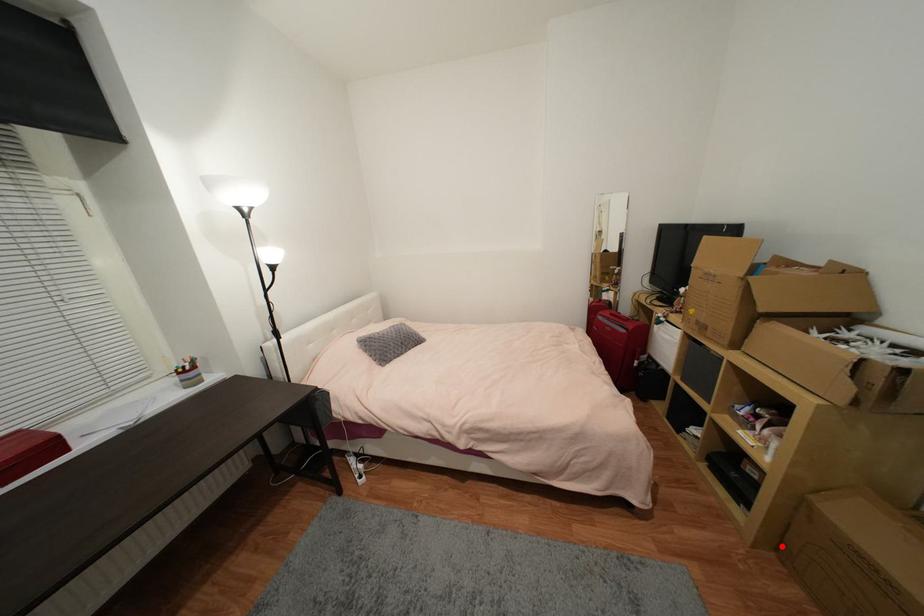
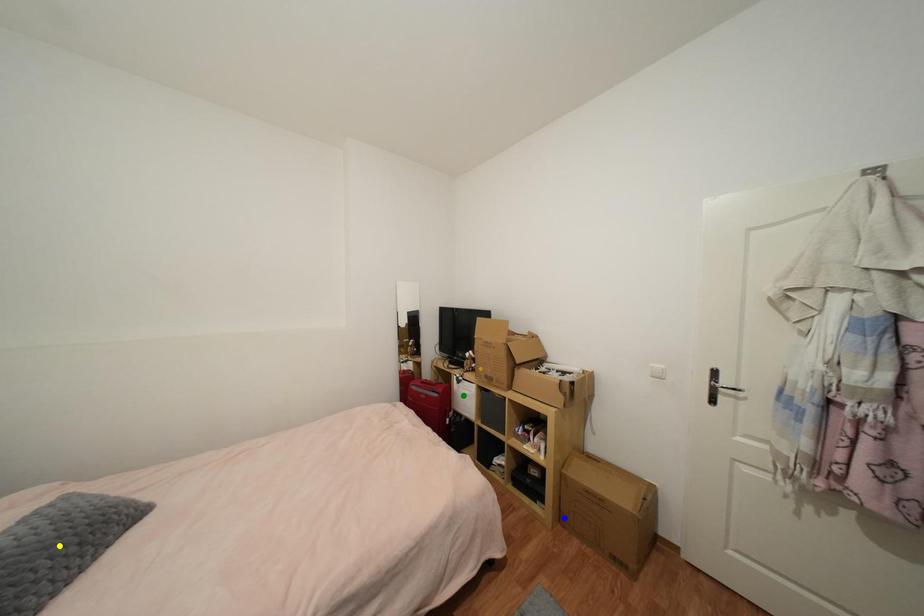
Question: I am providing you with two images of the same scene from different viewpoints. A red point is marked on the first image. You are given multiple points on the second image. Can you choose the point in image 2 that corresponds to the point in image 1?

Choices:
 (A) green point
 (B) yellow point
 (C) blue point

Answer: (C)